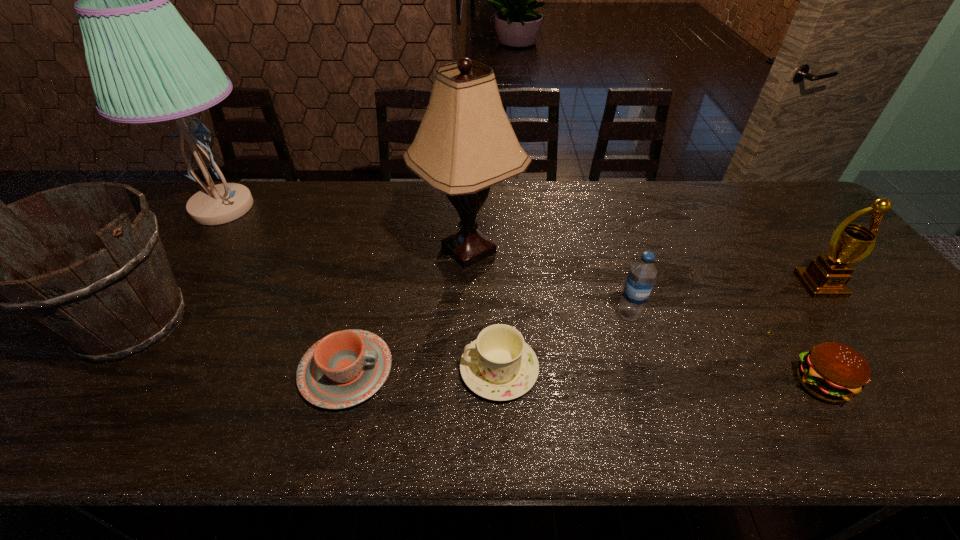
Locate an element on the screen. the sixth object from right to left is located at coordinates (345, 368).

Find the location of `blank space located 0.370m on the right of the left lamp`. blank space located 0.370m on the right of the left lamp is located at coordinates (387, 207).

Where is `vacant space located 0.270m on the right of the right lamp`? The width and height of the screenshot is (960, 540). vacant space located 0.270m on the right of the right lamp is located at coordinates (617, 250).

Find the location of `free region located on the back of the bucket`. free region located on the back of the bucket is located at coordinates (205, 222).

Locate an element on the screen. This screenshot has width=960, height=540. vacant space located 0.140m on the front-facing side of the fourth tallest object is located at coordinates (862, 343).

Where is `vacant space positioned on the label of the fourth shortest object`? vacant space positioned on the label of the fourth shortest object is located at coordinates [642, 357].

This screenshot has height=540, width=960. In order to click on vacant space situated on the right of the hamburger in this screenshot , I will do `click(903, 383)`.

Identify the location of vacant space located 0.090m on the handle side of the right chinaware. This screenshot has width=960, height=540. (420, 369).

This screenshot has width=960, height=540. Identify the location of free space located on the handle side of the right chinaware. (384, 369).

The height and width of the screenshot is (540, 960). In order to click on vacant space positioned 0.310m on the handle side of the right chinaware in this screenshot , I will do `click(322, 369)`.